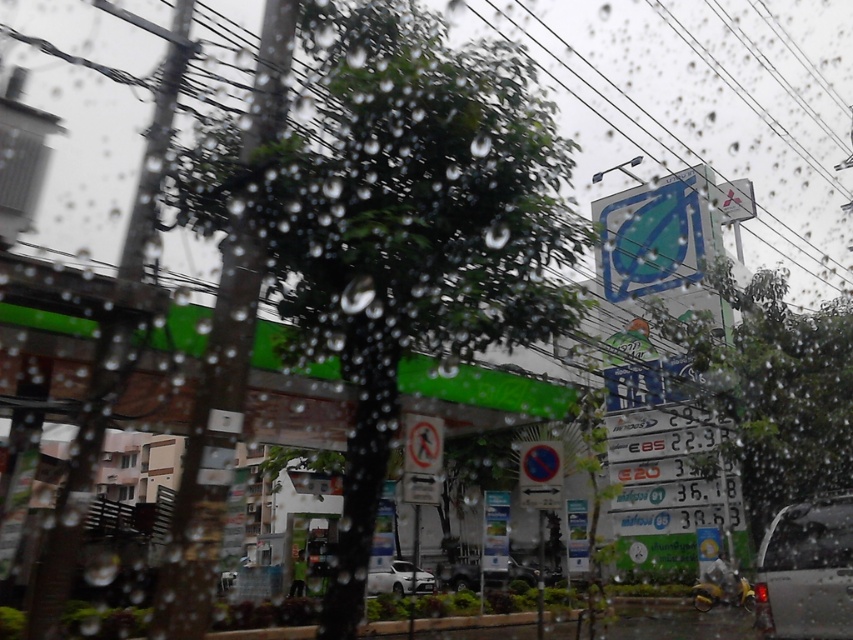
Question: Which point is farther from the camera taking this photo?

Choices:
 (A) (457, 589)
 (B) (366, 586)
 (C) (791, 625)

Answer: (A)

Question: Among these objects, which one is farthest from the camera?

Choices:
 (A) metallic silver suv at center
 (B) metallic silver car at lower right

Answer: (A)

Question: Is metallic silver car at lower right smaller than metallic silver suv at center?

Choices:
 (A) no
 (B) yes

Answer: (B)

Question: Does metallic silver car at lower right have a lesser width compared to white matte car at center?

Choices:
 (A) no
 (B) yes

Answer: (A)

Question: Where is metallic silver car at lower right located in relation to white matte car at center in the image?

Choices:
 (A) above
 (B) below

Answer: (A)

Question: Which object is positioned farthest from the white matte car at center?

Choices:
 (A) metallic silver suv at center
 (B) metallic silver car at lower right

Answer: (B)